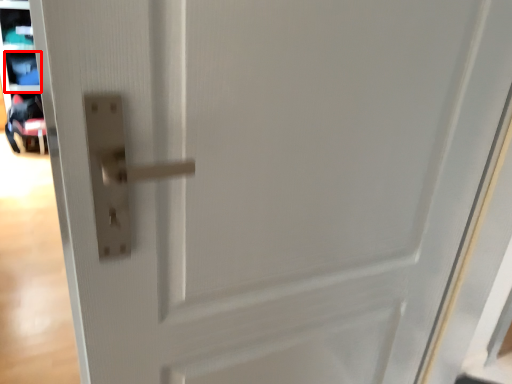
Question: From the image's perspective, where is shelf (annotated by the red box) located relative to baby carriage?

Choices:
 (A) above
 (B) below

Answer: (A)